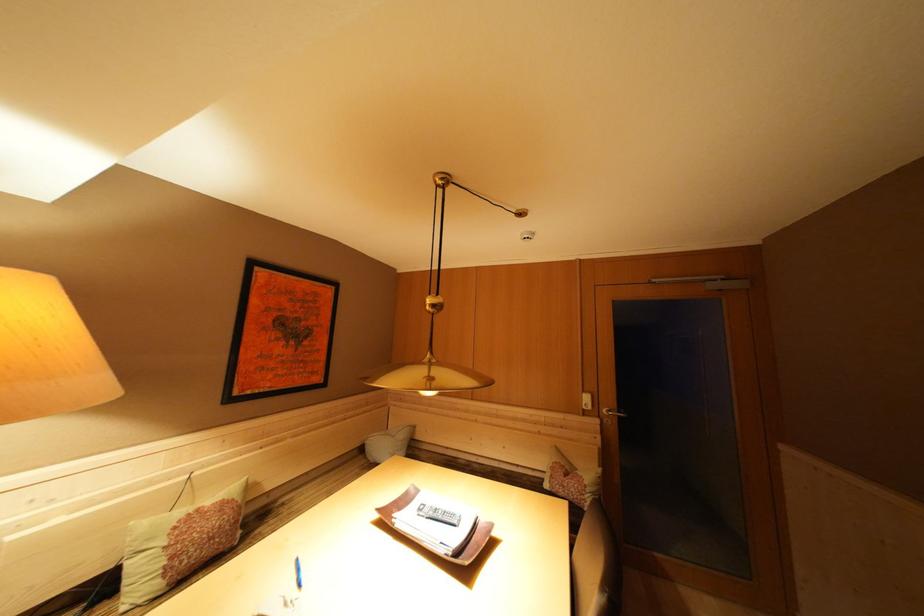
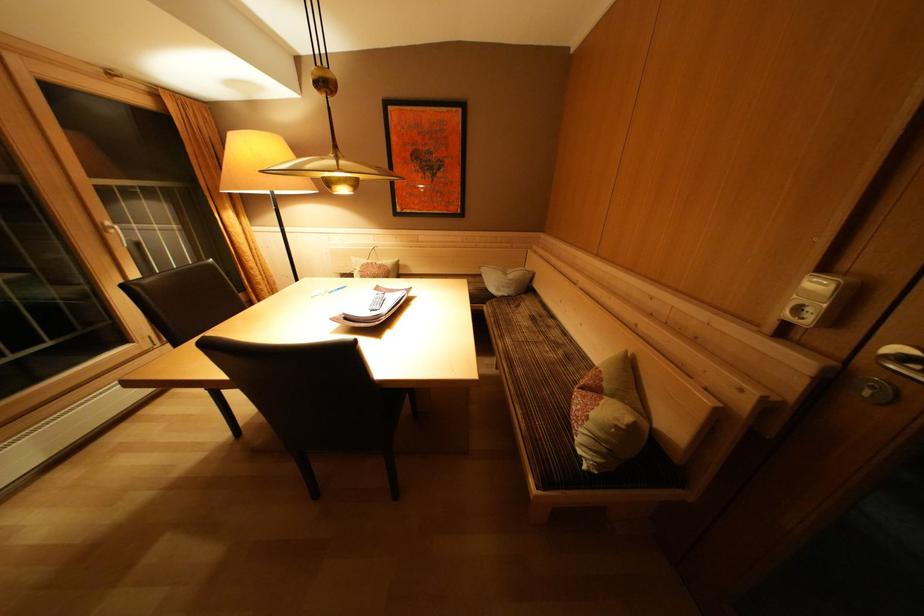
In the second image, find the point that corresponds to point (597, 413) in the first image.

(815, 326)